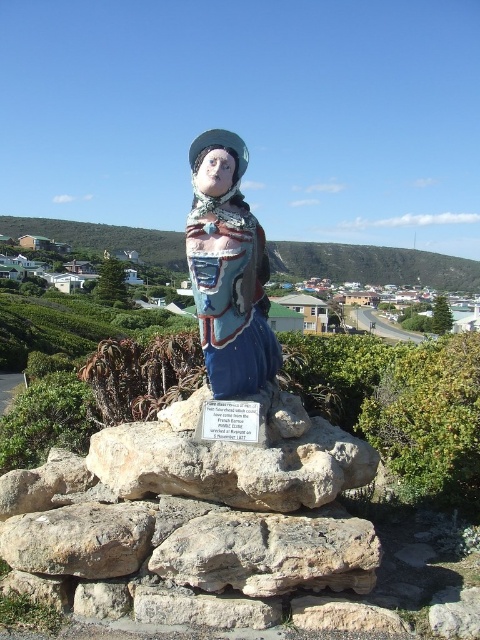
Question: Does painted ceramic statue at center have a lesser width compared to brown rough rock at lower left?

Choices:
 (A) no
 (B) yes

Answer: (B)

Question: Which object is farther from the camera taking this photo?

Choices:
 (A) gray rock at center
 (B) painted ceramic statue at center
 (C) gray rough stone at lower center

Answer: (B)

Question: Is painted ceramic statue at center positioned in front of brown rough rock at lower center?

Choices:
 (A) yes
 (B) no

Answer: (B)

Question: Among these points, which one is farthest from the camera?

Choices:
 (A) (373, 467)
 (B) (444, 260)
 (C) (256, 627)
 (D) (60, 557)

Answer: (B)

Question: Which object appears closest to the camera in this image?

Choices:
 (A) gray rock at center
 (B) gray rough stone at lower center

Answer: (B)

Question: Can you confirm if gray rock at center is positioned above gray rough stone at lower center?

Choices:
 (A) no
 (B) yes

Answer: (B)